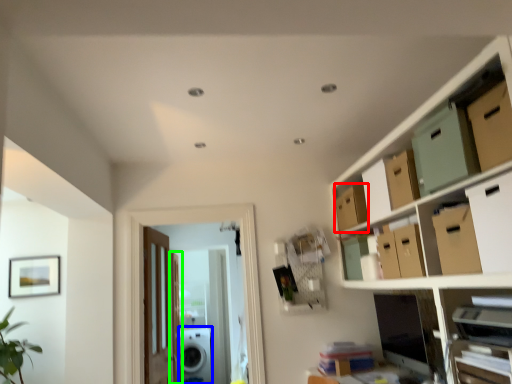
Question: Which is nearer to the storage box (highlighted by a red box)? appliance (highlighted by a blue box) or door (highlighted by a green box).

Choices:
 (A) appliance
 (B) door

Answer: (B)